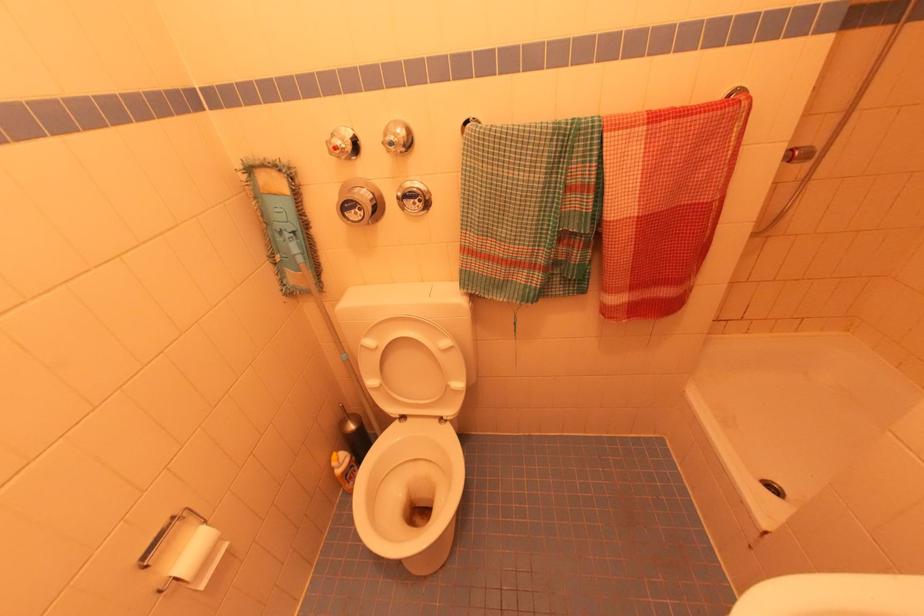
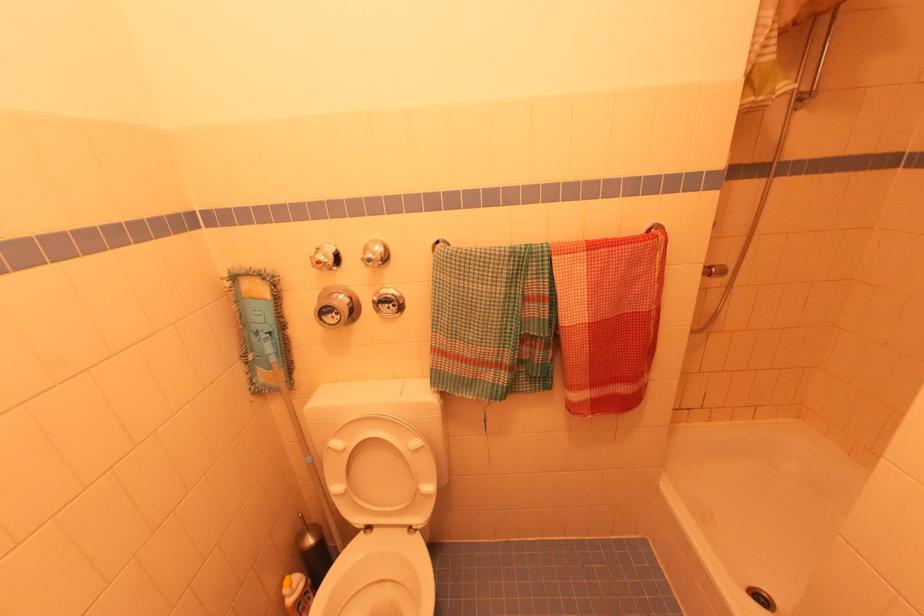
Locate, in the second image, the point that corresponds to the point at 420,201 in the first image.

(395, 306)